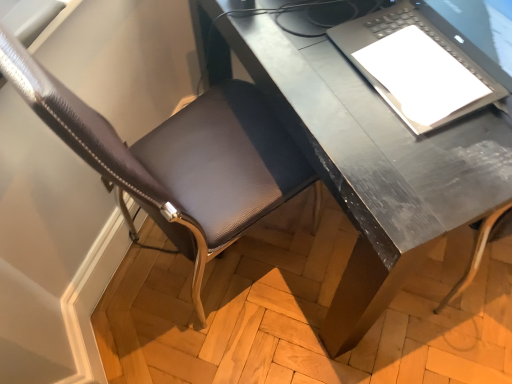
This screenshot has width=512, height=384. Find the location of `metallic gray desk at center`. metallic gray desk at center is located at coordinates (365, 159).

The height and width of the screenshot is (384, 512). In order to click on leather-like brown chair at lower left in this screenshot , I will do `click(179, 158)`.

What are the coordinates of `metallic gray desk at center` in the screenshot? It's located at (365, 159).

From the image's perspective, between leather-like brown chair at lower left and metallic gray desk at center, which one is located above?

metallic gray desk at center.

Could you tell me if leather-like brown chair at lower left is facing metallic gray desk at center?

Yes, leather-like brown chair at lower left is facing metallic gray desk at center.

The image size is (512, 384). In order to click on desk behind the leather-like brown chair at lower left in this screenshot , I will do `click(365, 159)`.

Considering the relative sizes of leather-like brown chair at lower left and metallic gray desk at center in the image provided, is leather-like brown chair at lower left thinner than metallic gray desk at center?

Yes.

Which object is positioned more to the right, metallic gray desk at center or matte black laptop at upper right?

metallic gray desk at center.

From the image's perspective, between metallic gray desk at center and matte black laptop at upper right, who is located below?

matte black laptop at upper right is shown below in the image.

Is metallic gray desk at center taller than matte black laptop at upper right?

Correct, metallic gray desk at center is much taller as matte black laptop at upper right.

Does matte black laptop at upper right touch leather-like brown chair at lower left?

No.

How distant is matte black laptop at upper right from leather-like brown chair at lower left?

A distance of 14.47 inches exists between matte black laptop at upper right and leather-like brown chair at lower left.

From the image's perspective, is matte black laptop at upper right on leather-like brown chair at lower left?

Indeed, from the image's perspective, matte black laptop at upper right is shown above leather-like brown chair at lower left.

Is point (347, 43) behind point (207, 169)?

No.

Is matte black laptop at upper right smaller than metallic gray desk at center?

Correct, matte black laptop at upper right occupies less space than metallic gray desk at center.

Considering the positions of objects matte black laptop at upper right and metallic gray desk at center in the image provided, who is more to the right, matte black laptop at upper right or metallic gray desk at center?

From the viewer's perspective, metallic gray desk at center appears more on the right side.

From the picture: From a real-world perspective, who is located higher, matte black laptop at upper right or metallic gray desk at center?

In real-world perspective, matte black laptop at upper right is above.

Which object is more forward, matte black laptop at upper right or metallic gray desk at center?

matte black laptop at upper right.

Between metallic gray desk at center and leather-like brown chair at lower left, which one is positioned behind?

Positioned behind is metallic gray desk at center.

Between metallic gray desk at center and leather-like brown chair at lower left, which one has more height?

Standing taller between the two is leather-like brown chair at lower left.

Does metallic gray desk at center turn towards leather-like brown chair at lower left?

No, metallic gray desk at center is not oriented towards leather-like brown chair at lower left.

In the scene shown: Is metallic gray desk at center to the left or to the right of leather-like brown chair at lower left in the image?

Based on their positions, metallic gray desk at center is located to the right of leather-like brown chair at lower left.

Can you tell me how much leather-like brown chair at lower left and matte black laptop at upper right differ in facing direction?

166 degrees separate the facing orientations of leather-like brown chair at lower left and matte black laptop at upper right.

Considering the sizes of objects leather-like brown chair at lower left and matte black laptop at upper right in the image provided, who is taller, leather-like brown chair at lower left or matte black laptop at upper right?

leather-like brown chair at lower left.

Between leather-like brown chair at lower left and matte black laptop at upper right, which one appears on the right side from the viewer's perspective?

From the viewer's perspective, matte black laptop at upper right appears more on the right side.

Is leather-like brown chair at lower left inside the boundaries of matte black laptop at upper right, or outside?

leather-like brown chair at lower left cannot be found inside matte black laptop at upper right.

Locate an element on the screen. The height and width of the screenshot is (384, 512). chair that appears above the metallic gray desk at center (from a real-world perspective) is located at coordinates (179, 158).

This screenshot has height=384, width=512. Find the location of `desk to the right of matte black laptop at upper right`. desk to the right of matte black laptop at upper right is located at coordinates (365, 159).

In the scene shown: Considering their positions, is leather-like brown chair at lower left positioned further to matte black laptop at upper right than metallic gray desk at center?

The object further to matte black laptop at upper right is leather-like brown chair at lower left.

Based on their spatial positions, is leather-like brown chair at lower left or matte black laptop at upper right further from metallic gray desk at center?

leather-like brown chair at lower left.

Based on their spatial positions, is metallic gray desk at center or matte black laptop at upper right closer to leather-like brown chair at lower left?

metallic gray desk at center is positioned closer to the anchor leather-like brown chair at lower left.

Looking at the image, which one is located closer to metallic gray desk at center, matte black laptop at upper right or leather-like brown chair at lower left?

matte black laptop at upper right.

When comparing their distances from leather-like brown chair at lower left, does matte black laptop at upper right or metallic gray desk at center seem closer?

The object closer to leather-like brown chair at lower left is metallic gray desk at center.

Estimate the real-world distances between objects in this image. Which object is closer to matte black laptop at upper right, metallic gray desk at center or leather-like brown chair at lower left?

Based on the image, metallic gray desk at center appears to be nearer to matte black laptop at upper right.

I want to click on laptop between leather-like brown chair at lower left and metallic gray desk at center from left to right, so [416, 66].